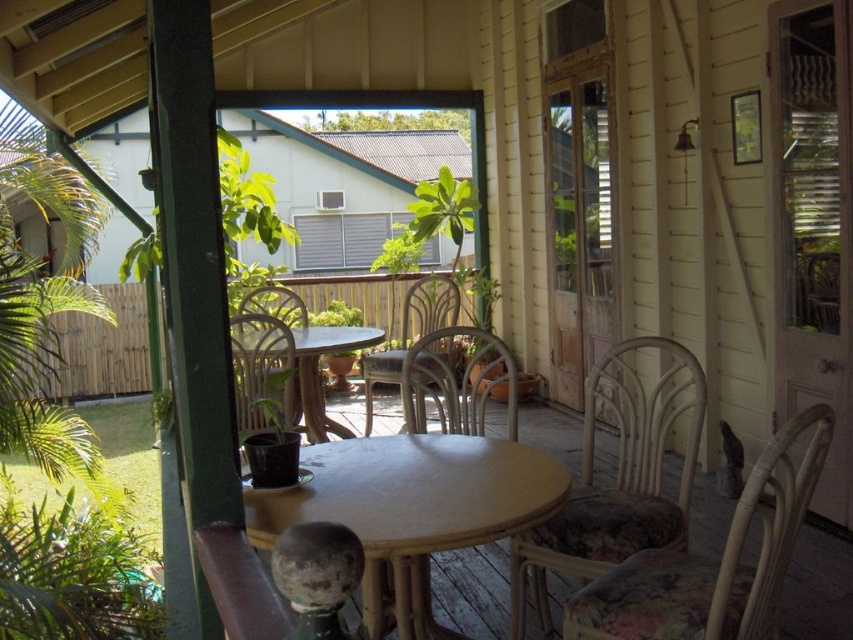
Question: Is woven rattan chair at lower right bigger than wicker chair at left?

Choices:
 (A) yes
 (B) no

Answer: (B)

Question: Does rattan chair at center have a smaller size compared to wicker chair at left?

Choices:
 (A) yes
 (B) no

Answer: (B)

Question: Considering the real-world distances, which object is farthest from the woven rattan chair at lower right?

Choices:
 (A) wicker chair at left
 (B) rattan chair at center
 (C) metallic silver chair at center
 (D) floral fabric chair at center

Answer: (A)

Question: Estimate the real-world distances between objects in this image. Which object is closer to the rattan chair at center?

Choices:
 (A) wooden round table at center
 (B) matte wicker chair at center
 (C) woven rattan chair at lower right
 (D) wicker chair at left

Answer: (B)

Question: Is woven rattan chair at lower right to the right of matte wicker chair at center from the viewer's perspective?

Choices:
 (A) yes
 (B) no

Answer: (A)

Question: Which point is closer to the camera?

Choices:
 (A) wooden round table at center
 (B) matte wicker chair at center

Answer: (B)